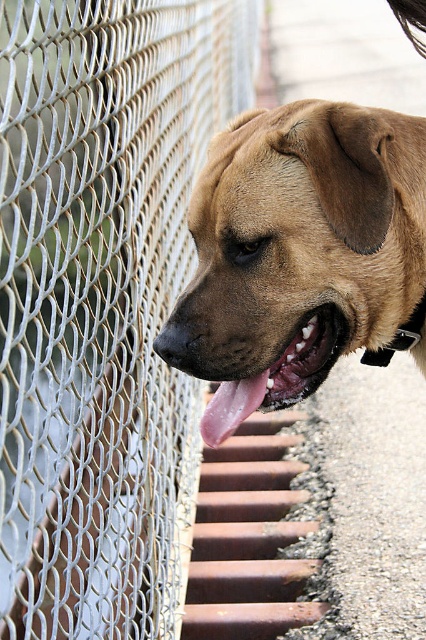
Question: Is silver mesh fence at left below brown matte dog at center?

Choices:
 (A) no
 (B) yes

Answer: (A)

Question: Which of the following is the closest to the observer?

Choices:
 (A) [x=253, y=378]
 (B) [x=109, y=93]

Answer: (A)

Question: Which point is closer to the camera?

Choices:
 (A) (226, 403)
 (B) (23, 58)
 (C) (333, 256)

Answer: (C)

Question: Which of the following is the closest to the observer?

Choices:
 (A) silver mesh fence at left
 (B) pink glossy tongue at center
 (C) brown matte dog at center

Answer: (A)

Question: Is brown matte dog at center thinner than pink glossy tongue at center?

Choices:
 (A) no
 (B) yes

Answer: (A)

Question: Can you confirm if brown matte dog at center is smaller than pink glossy tongue at center?

Choices:
 (A) no
 (B) yes

Answer: (A)